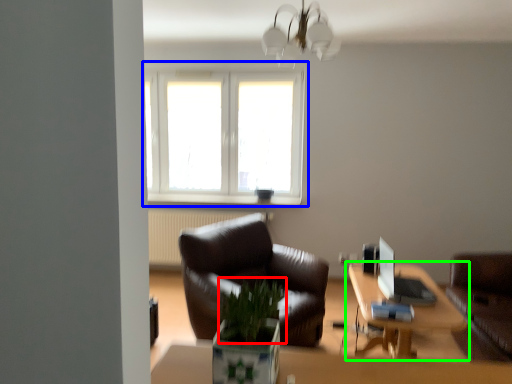
Question: Estimate the real-world distances between objects in this image. Which object is closer to plant (highlighted by a red box), window (highlighted by a blue box) or table (highlighted by a green box)?

Choices:
 (A) window
 (B) table

Answer: (B)